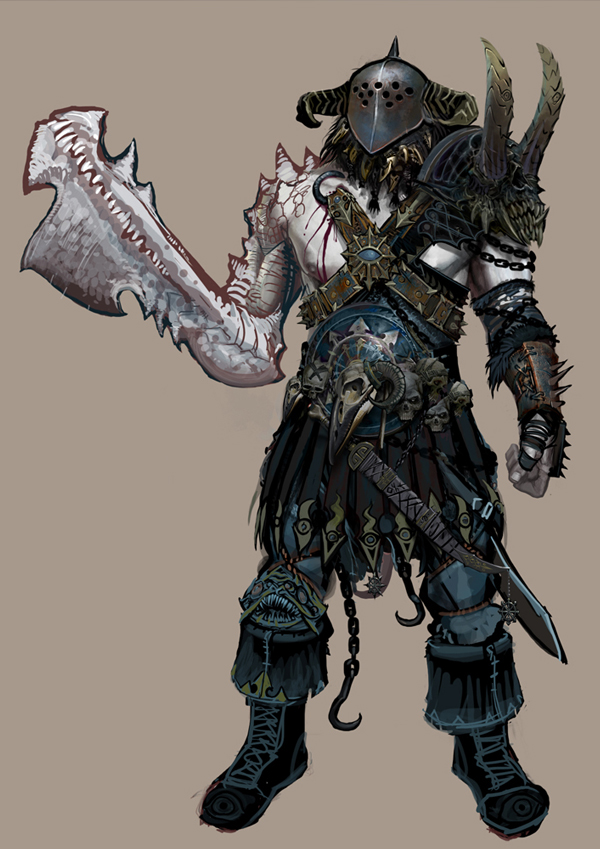
At what (x,y) coordinates should I click in order to perform the action: click on hook. Please return your answer as a coordinate pair (x, y). Looking at the image, I should click on (347, 726).